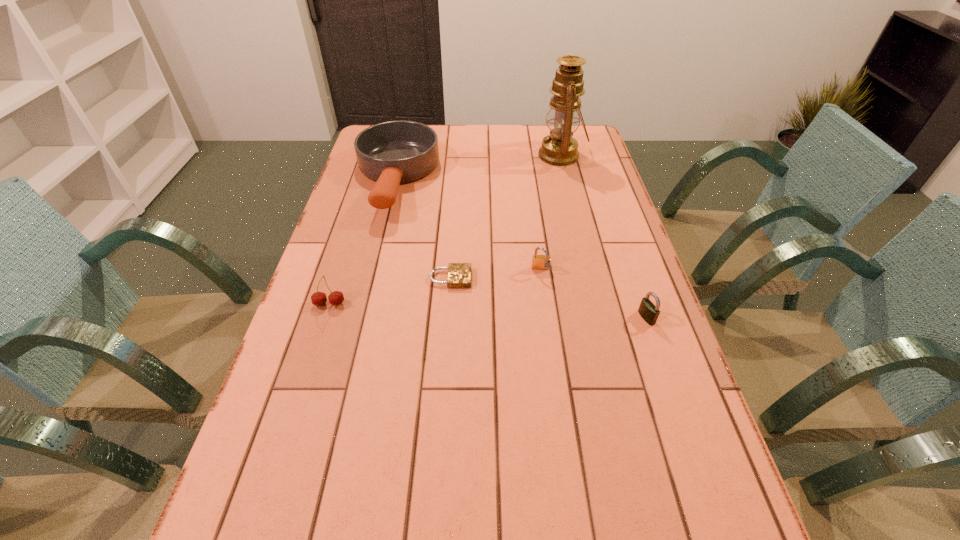
Where is `the tallest object`? This screenshot has width=960, height=540. the tallest object is located at coordinates (559, 148).

At what (x,y) coordinates should I click in order to perform the action: click on the second object from right to left. Please return your answer as a coordinate pair (x, y). Looking at the image, I should click on (x=559, y=148).

You are a GUI agent. You are given a task and a screenshot of the screen. Output one action in this format:
    pyautogui.click(x=<x>, y=<y>)
    Task: Click on the pan
    The height and width of the screenshot is (540, 960).
    Given the screenshot: What is the action you would take?
    pyautogui.click(x=393, y=152)

The width and height of the screenshot is (960, 540). Identify the location of cherry. (336, 298).

This screenshot has width=960, height=540. Identify the location of the second padlock from left to right. (539, 262).

Locate an element on the screen. This screenshot has width=960, height=540. the rightmost padlock is located at coordinates (648, 311).

Locate an element on the screen. This screenshot has width=960, height=540. the nearest padlock is located at coordinates (648, 311).

Where is `the fourth object from right to left`? This screenshot has height=540, width=960. the fourth object from right to left is located at coordinates click(459, 274).

Find the location of a particular element. This screenshot has width=960, height=540. the shortest object is located at coordinates [x=459, y=274].

Where is `free spot located 0.200m on the left of the second object from right to left`? free spot located 0.200m on the left of the second object from right to left is located at coordinates (484, 156).